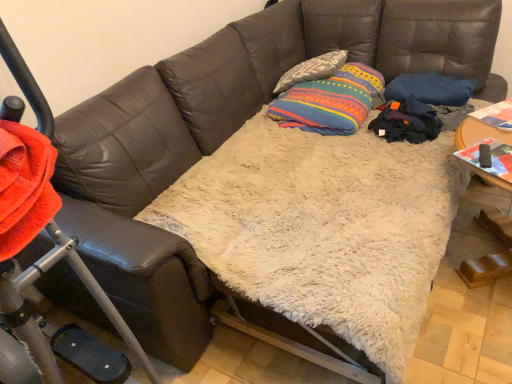
Question: Considering the relative sizes of textured gray pillow at upper center and multicolored striped fabric at center in the image provided, is textured gray pillow at upper center thinner than multicolored striped fabric at center?

Choices:
 (A) no
 (B) yes

Answer: (B)

Question: Does textured gray pillow at upper center touch multicolored striped fabric at center?

Choices:
 (A) no
 (B) yes

Answer: (A)

Question: Is textured gray pillow at upper center shorter than multicolored striped fabric at center?

Choices:
 (A) yes
 (B) no

Answer: (A)

Question: From the image's perspective, is textured gray pillow at upper center under multicolored striped fabric at center?

Choices:
 (A) no
 (B) yes

Answer: (A)

Question: Is textured gray pillow at upper center facing towards multicolored striped fabric at center?

Choices:
 (A) no
 (B) yes

Answer: (A)

Question: Does textured gray pillow at upper center have a smaller size compared to multicolored striped fabric at center?

Choices:
 (A) no
 (B) yes

Answer: (B)

Question: Is multicolored striped fabric at center positioned in front of textured gray pillow at upper center?

Choices:
 (A) no
 (B) yes

Answer: (B)

Question: Could textured gray pillow at upper center be considered to be inside multicolored striped fabric at center?

Choices:
 (A) yes
 (B) no

Answer: (B)

Question: Can you confirm if multicolored striped fabric at center is wider than textured gray pillow at upper center?

Choices:
 (A) no
 (B) yes

Answer: (B)

Question: Can you confirm if multicolored striped fabric at center is positioned to the left of textured gray pillow at upper center?

Choices:
 (A) no
 (B) yes

Answer: (A)

Question: Is multicolored striped fabric at center next to textured gray pillow at upper center?

Choices:
 (A) yes
 (B) no

Answer: (B)

Question: Can you confirm if multicolored striped fabric at center is bigger than textured gray pillow at upper center?

Choices:
 (A) no
 (B) yes

Answer: (B)

Question: From a real-world perspective, relative to multicolored striped fabric at center, is textured gray pillow at upper center vertically above or below?

Choices:
 (A) below
 (B) above

Answer: (B)